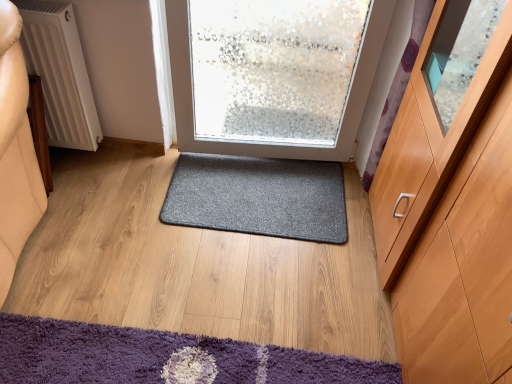
I want to click on free space above purple shaggy mat at lower left, the 1th mat positioned from the front (from a real-world perspective), so click(x=161, y=359).